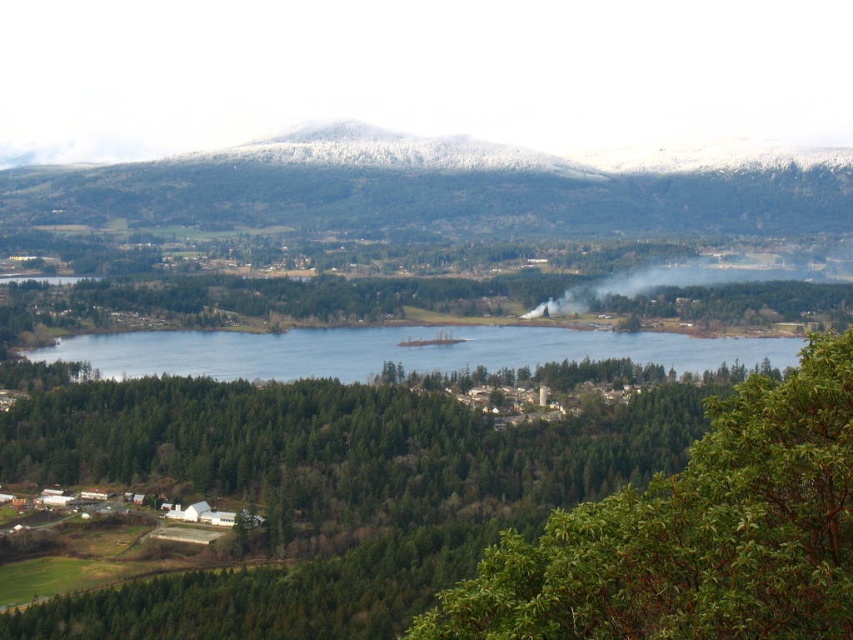
Does green leafy tree at center come in front of blue water at center?

Yes, it is.

Based on the photo, who is shorter, green leafy tree at center or blue water at center?

blue water at center

Where is `green leafy tree at center`? The width and height of the screenshot is (853, 640). green leafy tree at center is located at coordinates (694, 532).